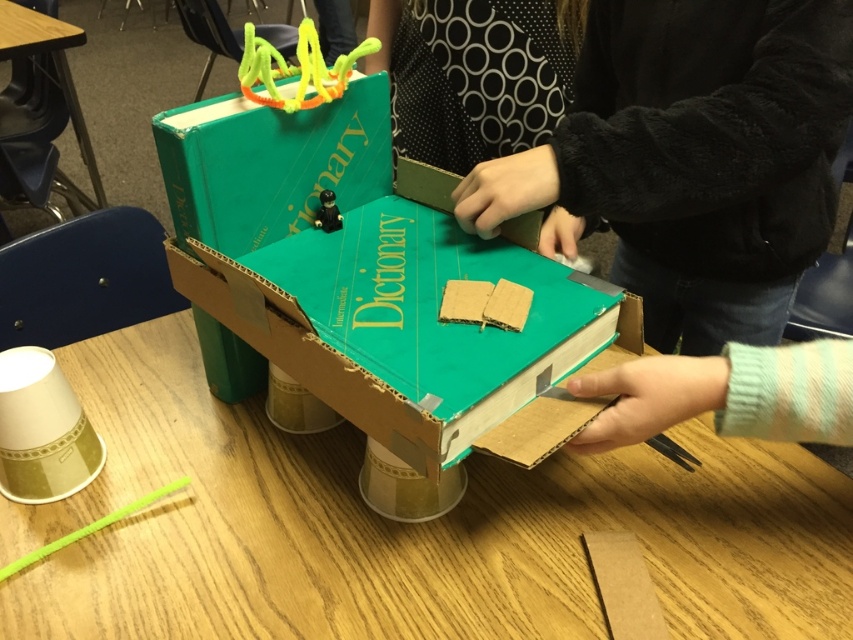
Question: Which point appears farthest from the camera in this image?

Choices:
 (A) (56, 58)
 (B) (334, 227)

Answer: (A)

Question: Considering the relative positions of black dotted fabric at upper center and cardboard at center in the image provided, where is black dotted fabric at upper center located with respect to cardboard at center?

Choices:
 (A) above
 (B) below

Answer: (A)

Question: Which point appears farthest from the camera in this image?

Choices:
 (A) (712, 458)
 (B) (508, 20)
 (C) (325, 193)
 (D) (27, 32)

Answer: (D)

Question: Is black fuzzy jacket at upper center below wooden table at lower left?

Choices:
 (A) no
 (B) yes

Answer: (B)

Question: Is green cardboard box at center smaller than wooden table at lower left?

Choices:
 (A) no
 (B) yes

Answer: (B)

Question: Which is farther from the wooden table at lower left?

Choices:
 (A) black fuzzy jacket at upper center
 (B) green cardboard box at center
 (C) cardboard at center
 (D) black dotted fabric at upper center

Answer: (C)